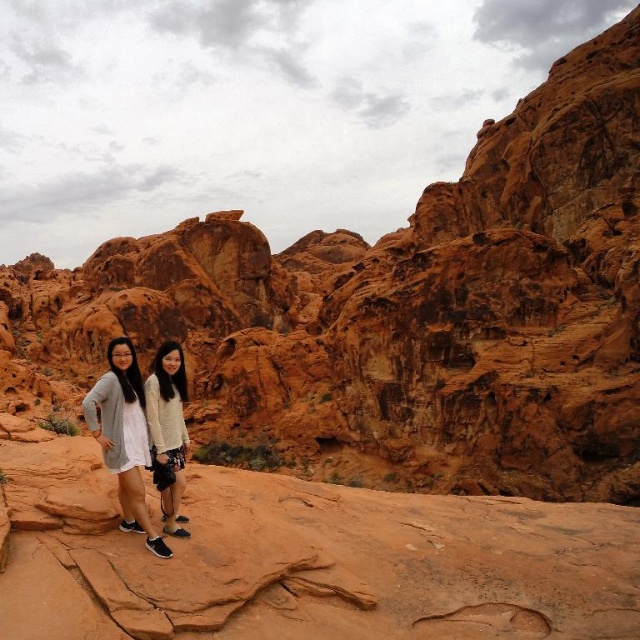
You are an outdoor photographer planning to capture the desert landscape. You need to ensure that both the matte gray sweater at lower left and the white fuzzy sweater at center are visible in your shot. Which sweater should you focus on first to ensure it doesn,t get cropped out of the frame?

The matte gray sweater at lower left is larger in size compared to the white fuzzy sweater at center. Since it is bigger, you should focus on ensuring the matte gray sweater at lower left is fully within the frame first, as it might occupy more space and be more likely to get cut off if not properly framed.

You are a photographer planning to take a group photo of the two people in the desert scene. You want to ensure both the matte gray sweater at lower left and the white fuzzy sweater at center are clearly visible in the frame. Based on their positions, which sweater is closer to the camera?

The matte gray sweater at lower left is in front of the white fuzzy sweater at center, so it is closer to the camera.

You are a photographer setting up a shoot in the desert. You have two sweaters to place on the rocky terrain for a photo. The matte gray sweater at lower left and the white fuzzy sweater at center. Based on their sizes, which sweater would you choose to ensure it doesn t get lost in the vast desert background?

The matte gray sweater at lower left has a greater height compared to the white fuzzy sweater at center, so it would be more visible against the vast desert background and less likely to get lost.